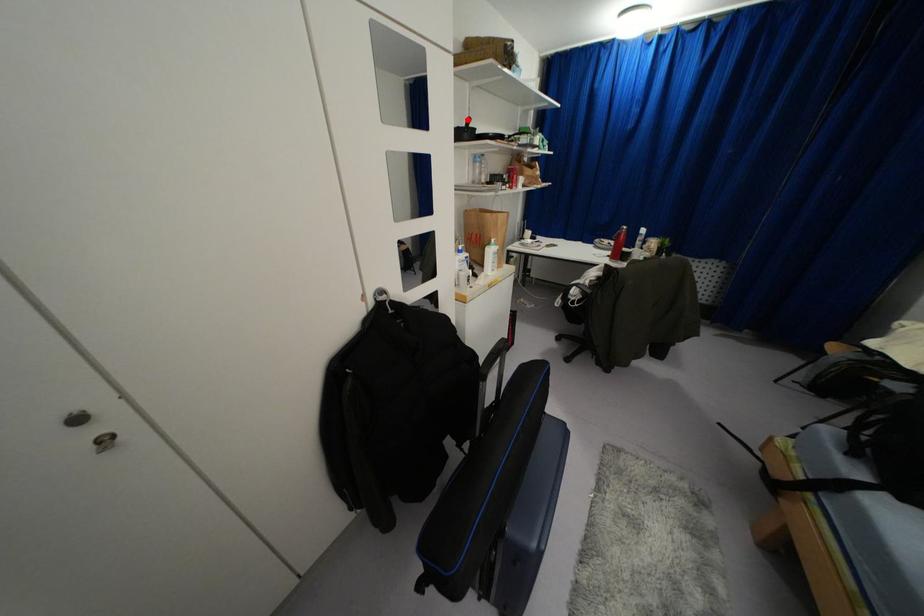
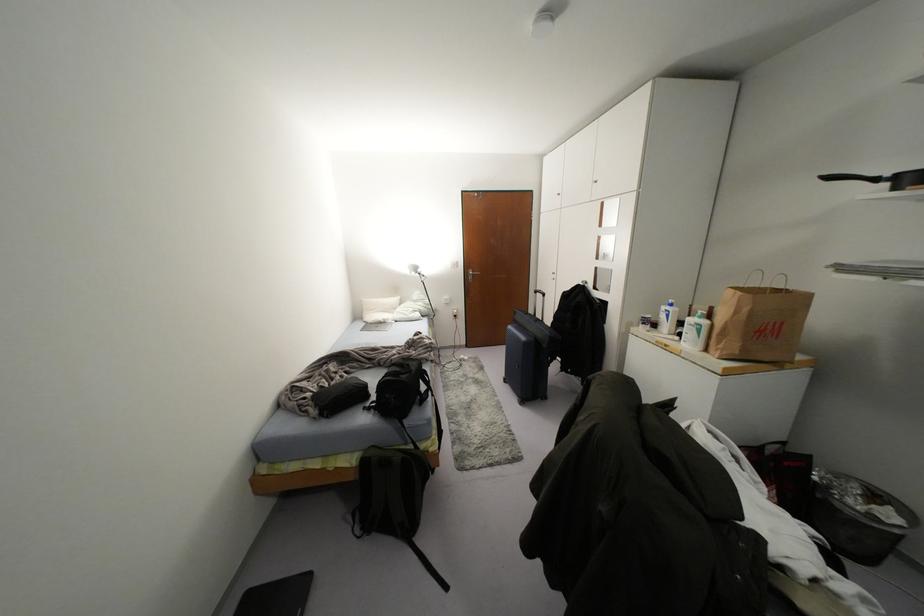
Question: I am providing you with two images of the same scene from different viewpoints. A red point is shown in image1. For the corresponding object point in image2, is it positioned nearer or farther from the camera?

Choices:
 (A) Nearer
 (B) Farther

Answer: (B)